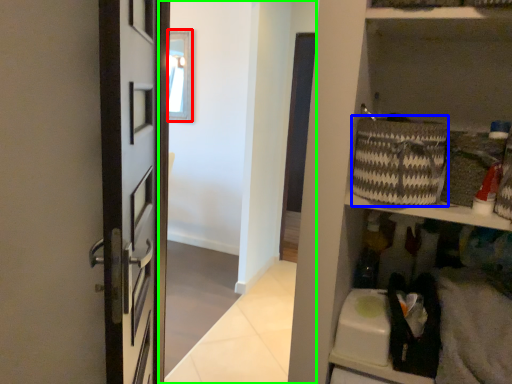
Question: Based on their relative distances, which object is nearer to window (highlighted by a red box)? Choose from basket (highlighted by a blue box) and corridor (highlighted by a green box).

Choices:
 (A) basket
 (B) corridor

Answer: (B)